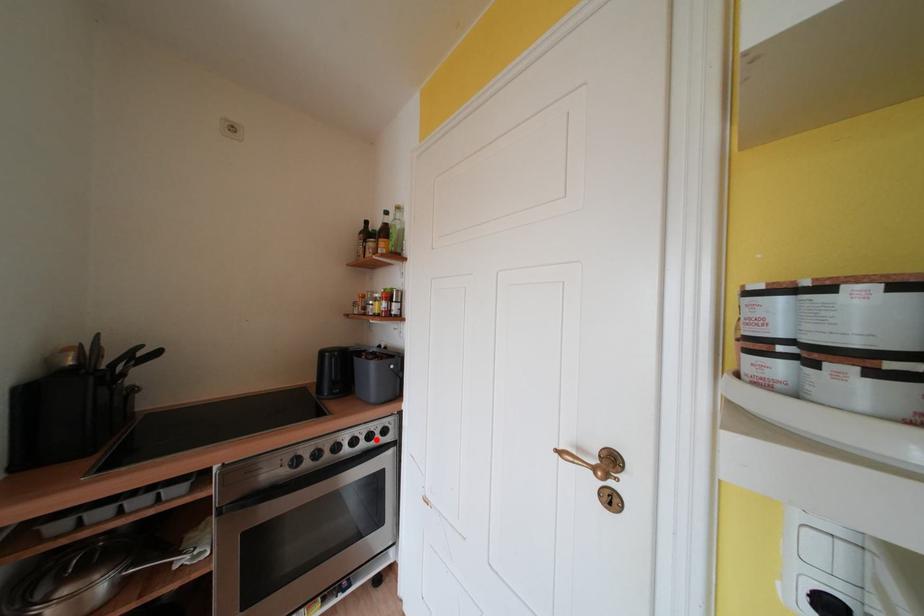
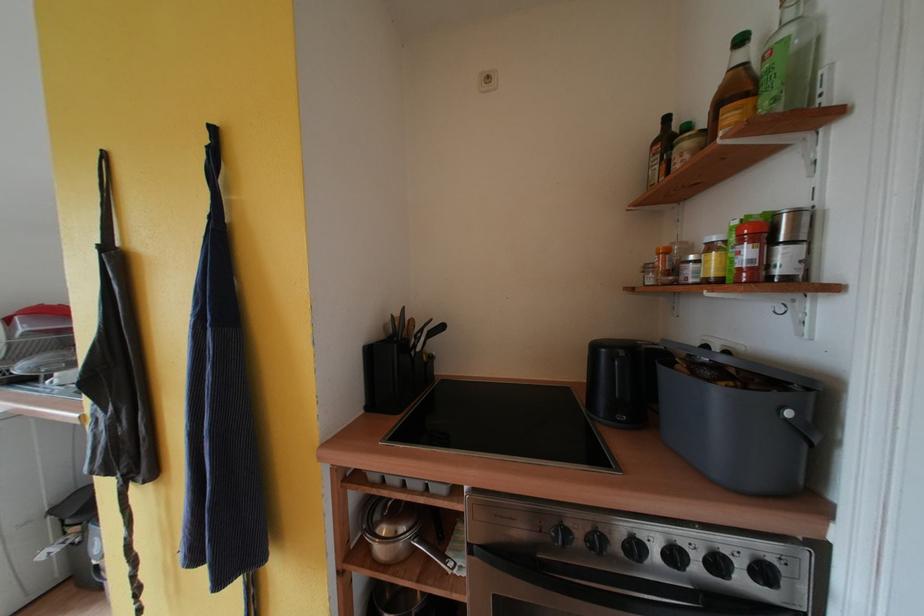
Question: I am providing you with two images of the same scene from different viewpoints. A red point is shown in image1. For the corresponding object point in image2, is it positioned nearer or farther from the camera?

Choices:
 (A) Nearer
 (B) Farther

Answer: (A)